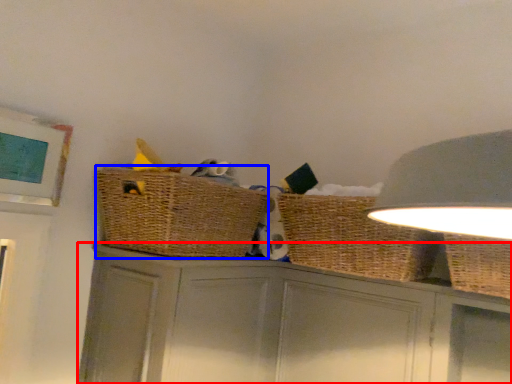
Question: Which of the following is the farthest to the observer, cabinetry (highlighted by a red box) or basket container (highlighted by a blue box)?

Choices:
 (A) cabinetry
 (B) basket container

Answer: (B)